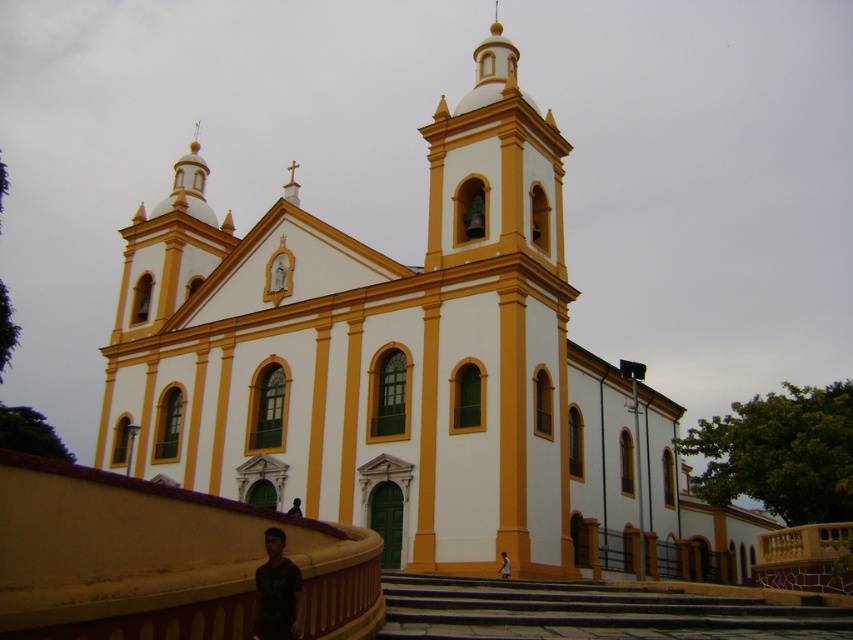
Is point (267, 595) positioned after point (292, 500)?

No, it is not.

Does point (270, 618) come closer to viewer compared to point (294, 509)?

Yes.

At what (x,y) coordinates should I click in order to perform the action: click on black matte shirt at lower center. Please return your answer as a coordinate pair (x, y). Looking at the image, I should click on (277, 593).

Is white smooth church at center wider than black matte man at lower center?

Indeed, white smooth church at center has a greater width compared to black matte man at lower center.

Between white smooth church at center and black matte man at lower center, which one has less height?

black matte man at lower center

Who is more forward, (200,232) or (297,497)?

Point (297,497) is in front.

You are a GUI agent. You are given a task and a screenshot of the screen. Output one action in this format:
    pyautogui.click(x=<x>, y=<y>)
    Task: Click on the white smooth church at center
    Image resolution: width=853 pixels, height=640 pixels.
    Given the screenshot: What is the action you would take?
    pyautogui.click(x=408, y=369)

Looking at this image, measure the distance between point (254,621) and camera.

Point (254,621) is 29.09 meters from camera.

What are the coordinates of `black matte shirt at lower center` in the screenshot? It's located at (277, 593).